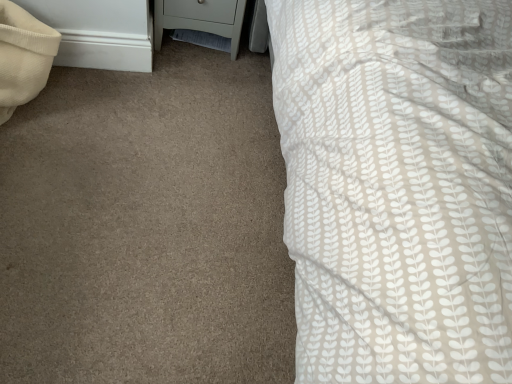
Find the location of a particular element. The width and height of the screenshot is (512, 384). beige textured pillow at left is located at coordinates (23, 57).

What do you see at coordinates (23, 57) in the screenshot? This screenshot has height=384, width=512. I see `beige textured pillow at left` at bounding box center [23, 57].

What do you see at coordinates (200, 18) in the screenshot?
I see `light gray matte nightstand at lower left` at bounding box center [200, 18].

You are a GUI agent. You are given a task and a screenshot of the screen. Output one action in this format:
    pyautogui.click(x=<x>, y=<y>)
    Task: Click on the light gray matte nightstand at lower left
    
    Given the screenshot: What is the action you would take?
    pyautogui.click(x=200, y=18)

What are the coordinates of `beige textured pillow at left` in the screenshot? It's located at (23, 57).

Considering the relative positions of beige textured pillow at left and light gray matte nightstand at lower left in the image provided, is beige textured pillow at left to the left of light gray matte nightstand at lower left from the viewer's perspective?

Yes.

Which object is more forward, beige textured pillow at left or light gray matte nightstand at lower left?

beige textured pillow at left is closer to the camera.

Which point is more distant from viewer, (42,48) or (174,26)?

Positioned behind is point (174,26).

From the image's perspective, which is above, beige textured pillow at left or light gray matte nightstand at lower left?

From the image's view, light gray matte nightstand at lower left is above.

In the scene shown: From a real-world perspective, which is physically below, beige textured pillow at left or light gray matte nightstand at lower left?

light gray matte nightstand at lower left is physically lower.

Looking at their sizes, would you say beige textured pillow at left is wider or thinner than light gray matte nightstand at lower left?

In the image, beige textured pillow at left appears to be more narrow than light gray matte nightstand at lower left.

Who is shorter, beige textured pillow at left or light gray matte nightstand at lower left?

light gray matte nightstand at lower left is shorter.

Who is smaller, beige textured pillow at left or light gray matte nightstand at lower left?

beige textured pillow at left is smaller.

Is beige textured pillow at left spatially inside light gray matte nightstand at lower left, or outside of it?

beige textured pillow at left is not inside light gray matte nightstand at lower left, it's outside.

Is beige textured pillow at left with light gray matte nightstand at lower left?

No, beige textured pillow at left is not beside light gray matte nightstand at lower left.

Could you tell me if beige textured pillow at left is facing light gray matte nightstand at lower left?

No, beige textured pillow at left is not oriented towards light gray matte nightstand at lower left.

Based on the photo, how many degrees apart are the facing directions of beige textured pillow at left and light gray matte nightstand at lower left?

88.8 degrees separate the facing orientations of beige textured pillow at left and light gray matte nightstand at lower left.

At what (x,y) coordinates should I click in order to perform the action: click on nightstand lying behind the beige textured pillow at left. Please return your answer as a coordinate pair (x, y). The height and width of the screenshot is (384, 512). Looking at the image, I should click on (200, 18).

Between light gray matte nightstand at lower left and beige textured pillow at left, which one appears on the left side from the viewer's perspective?

→ Positioned to the left is beige textured pillow at left.

Does light gray matte nightstand at lower left lie in front of beige textured pillow at left?

No, light gray matte nightstand at lower left is further to the viewer.

Is point (223, 24) in front of point (10, 38)?

No, (223, 24) is further to viewer.

From the image's perspective, between light gray matte nightstand at lower left and beige textured pillow at left, who is located below?

From the image's view, beige textured pillow at left is below.

From a real-world perspective, is light gray matte nightstand at lower left above or below beige textured pillow at left?

light gray matte nightstand at lower left is situated lower than beige textured pillow at left in the real world.

Considering the relative sizes of light gray matte nightstand at lower left and beige textured pillow at left in the image provided, is light gray matte nightstand at lower left wider than beige textured pillow at left?

Yes, light gray matte nightstand at lower left is wider than beige textured pillow at left.

Between light gray matte nightstand at lower left and beige textured pillow at left, which one has less height?

Standing shorter between the two is light gray matte nightstand at lower left.

Who is smaller, light gray matte nightstand at lower left or beige textured pillow at left?

beige textured pillow at left is smaller.

Is light gray matte nightstand at lower left situated inside beige textured pillow at left or outside?

light gray matte nightstand at lower left exists outside the volume of beige textured pillow at left.

Is light gray matte nightstand at lower left beside beige textured pillow at left?

light gray matte nightstand at lower left and beige textured pillow at left are not in contact.

Is light gray matte nightstand at lower left aimed at beige textured pillow at left?

No, light gray matte nightstand at lower left is not facing towards beige textured pillow at left.

The height and width of the screenshot is (384, 512). In order to click on pillow on the left side of light gray matte nightstand at lower left in this screenshot , I will do `click(23, 57)`.

Where is `pillow lying below the light gray matte nightstand at lower left (from the image's perspective)`? pillow lying below the light gray matte nightstand at lower left (from the image's perspective) is located at coordinates (23, 57).

This screenshot has height=384, width=512. Identify the location of pillow that appears on the left of light gray matte nightstand at lower left. (23, 57).